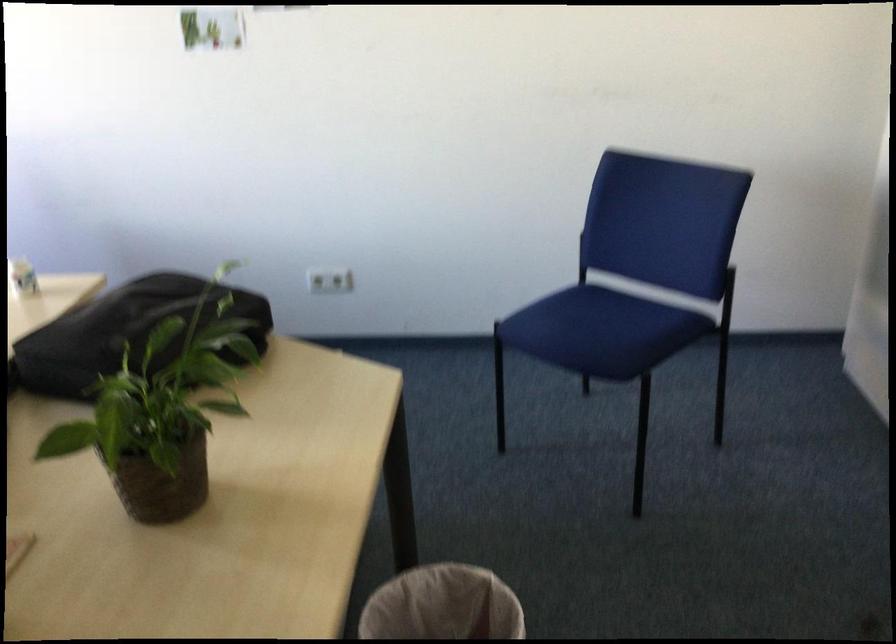
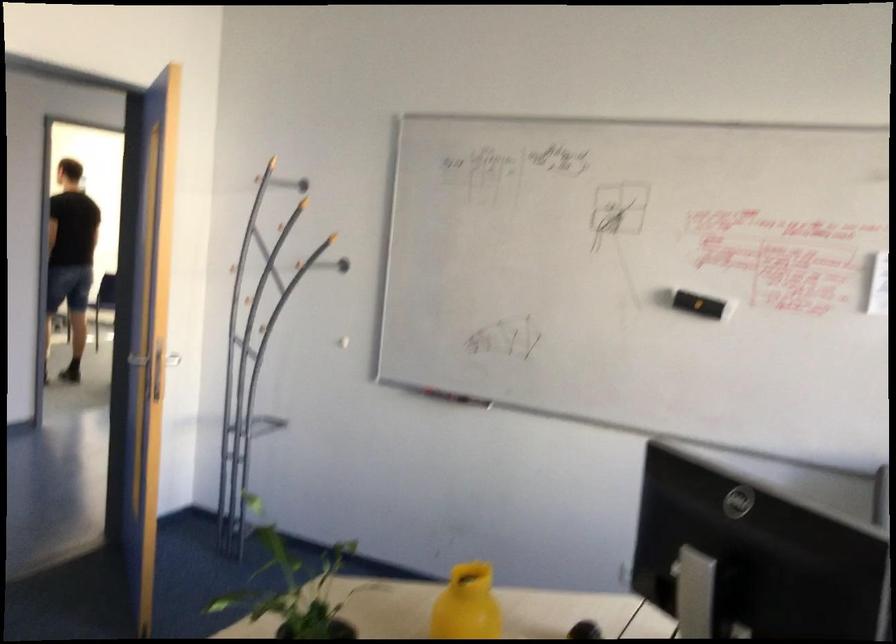
The point at (159, 480) is marked in the first image. Where is the corresponding point in the second image?

(294, 589)